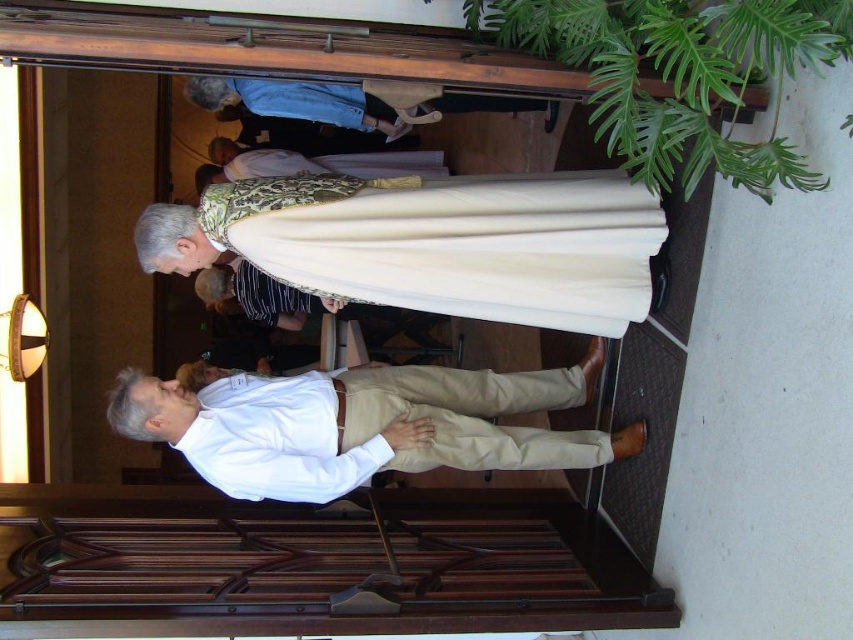
Which of these two, white cotton shirt at center or gold textured robe at center, stands taller?

white cotton shirt at center

Is white cotton shirt at center to the left of gold textured robe at center from the viewer's perspective?

No, white cotton shirt at center is not to the left of gold textured robe at center.

Does point (519, 468) come closer to viewer compared to point (370, 170)?

Yes, it is in front of point (370, 170).

Where is `white cotton shirt at center`? white cotton shirt at center is located at coordinates (363, 424).

Which is above, white cotton shirt at center or white smooth dress shirt at lower center?

white cotton shirt at center is higher up.

Is white cotton shirt at center closer to the viewer compared to white smooth dress shirt at lower center?

No.

Is point (363, 477) positioned after point (274, 413)?

No.

What are the coordinates of `white cotton shirt at center` in the screenshot? It's located at (363, 424).

Does white smooth dress shirt at lower center appear on the left side of gold textured robe at center?

In fact, white smooth dress shirt at lower center is to the right of gold textured robe at center.

In the scene shown: Who is positioned more to the right, white smooth dress shirt at lower center or gold textured robe at center?

white smooth dress shirt at lower center is more to the right.

You are a GUI agent. You are given a task and a screenshot of the screen. Output one action in this format:
    pyautogui.click(x=<x>, y=<y>)
    Task: Click on the white smooth dress shirt at lower center
    Image resolution: width=853 pixels, height=640 pixels.
    Given the screenshot: What is the action you would take?
    pyautogui.click(x=277, y=440)